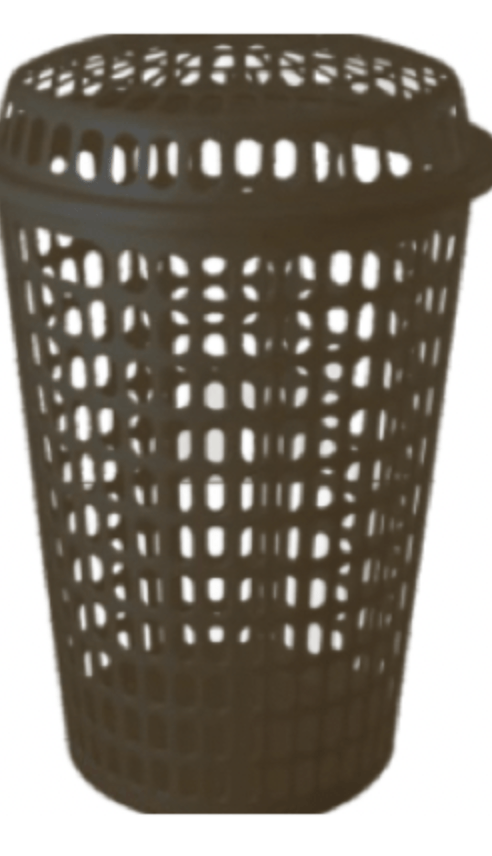
Where is `top of basket`? Image resolution: width=492 pixels, height=856 pixels. top of basket is located at coordinates (159, 230).